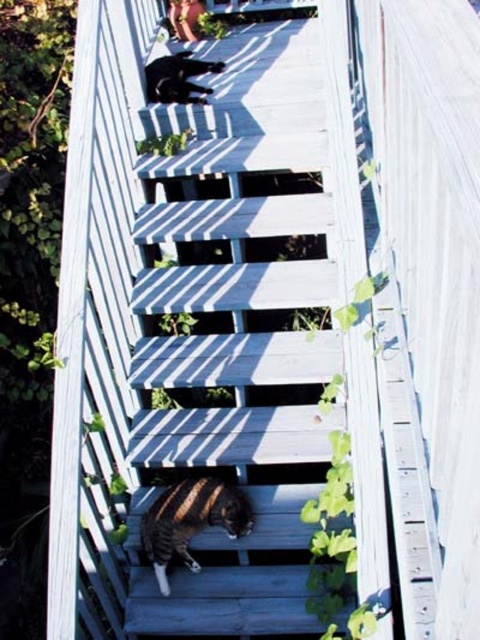
Question: Can you confirm if tabby fur cat at center is positioned to the left of shiny black cat at upper center?

Choices:
 (A) no
 (B) yes

Answer: (A)

Question: Among these points, which one is nearest to the camera?

Choices:
 (A) (167, 88)
 (B) (169, 536)

Answer: (B)

Question: Which point appears closest to the camera in this image?

Choices:
 (A) (191, 483)
 (B) (216, 61)
 (C) (180, 176)

Answer: (A)

Question: Which point is farther to the camera?

Choices:
 (A) shiny black cat at upper center
 (B) smooth wooden stairs at upper center
 (C) tabby fur cat at center

Answer: (A)

Question: Is smooth wooden stairs at upper center to the right of tabby fur cat at center from the viewer's perspective?

Choices:
 (A) yes
 (B) no

Answer: (A)

Question: Is smooth wooden stairs at upper center positioned in front of shiny black cat at upper center?

Choices:
 (A) yes
 (B) no

Answer: (A)